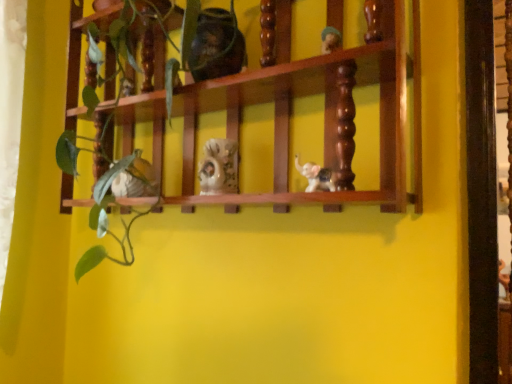
Question: Based on their positions, is matte ceramic elephant at center, which ranks as the fourth toy in left-to-right order, located to the left or right of wooden shelf at center?

Choices:
 (A) left
 (B) right

Answer: (B)

Question: Is matte ceramic elephant at center, the 1th toy in the right-to-left sequence, taller or shorter than wooden shelf at center?

Choices:
 (A) tall
 (B) short

Answer: (B)

Question: Estimate the real-world distances between objects in this image. Which object is farther from the matte ceramic elephant at center, the 1th toy in the right-to-left sequence?

Choices:
 (A) porcelain figurine at center, which ranks as the second toy in right-to-left order
 (B) matte brown vase at upper center, the third toy in the right-to-left sequence
 (C) green matte plant at center
 (D) wooden shelf at center
 (E) matte ceramic elephant at center, the second toy positioned from the bottom

Answer: (C)

Question: Estimate the real-world distances between objects in this image. Which object is closer to the green matte plant at center?

Choices:
 (A) porcelain figurine at center, which is the third toy in bottom-to-top order
 (B) matte ceramic elephant at center, the second toy positioned from the bottom
 (C) matte ceramic elephant at center, the fourth toy from the top
 (D) wooden shelf at center
 (E) matte brown vase at upper center, which ranks as the second toy in left-to-right order

Answer: (D)